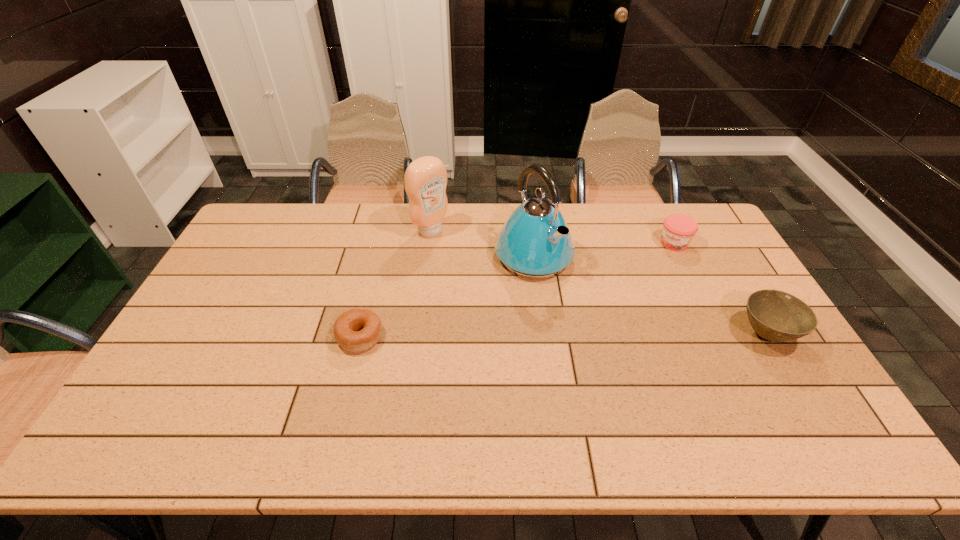
Where is `vacant space that's between the leftmost object and the second object from left to right`? Image resolution: width=960 pixels, height=540 pixels. vacant space that's between the leftmost object and the second object from left to right is located at coordinates (396, 283).

Locate an element on the screen. This screenshot has width=960, height=540. free point between the condiment and the kettle is located at coordinates (482, 243).

The width and height of the screenshot is (960, 540). I want to click on vacant area between the condiment and the bowl, so (598, 282).

Image resolution: width=960 pixels, height=540 pixels. Find the location of `vacant space that's between the bowl and the tallest object`. vacant space that's between the bowl and the tallest object is located at coordinates (650, 295).

Find the location of a particular element. vacant area that lies between the second tallest object and the third object from left to right is located at coordinates (482, 243).

Where is `vacant area between the second object from left to right and the leftmost object`? vacant area between the second object from left to right and the leftmost object is located at coordinates (396, 283).

Locate an element on the screen. Image resolution: width=960 pixels, height=540 pixels. vacant area that lies between the leftmost object and the jam is located at coordinates (517, 290).

Where is `object that is the fourth nearest to the jam`? The image size is (960, 540). object that is the fourth nearest to the jam is located at coordinates (356, 330).

In order to click on the closest object to the second object from left to right in this screenshot , I will do [535, 242].

This screenshot has width=960, height=540. I want to click on vacant space that satisfies the following two spatial constraints: 1. on the front side of the jam; 2. on the left side of the second tallest object, so click(429, 244).